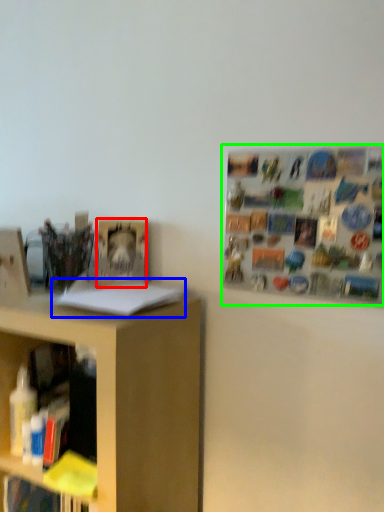
Question: Which is farther away from book (highlighted by a red box)? book (highlighted by a blue box) or bulletin board (highlighted by a green box)?

Choices:
 (A) book
 (B) bulletin board

Answer: (B)